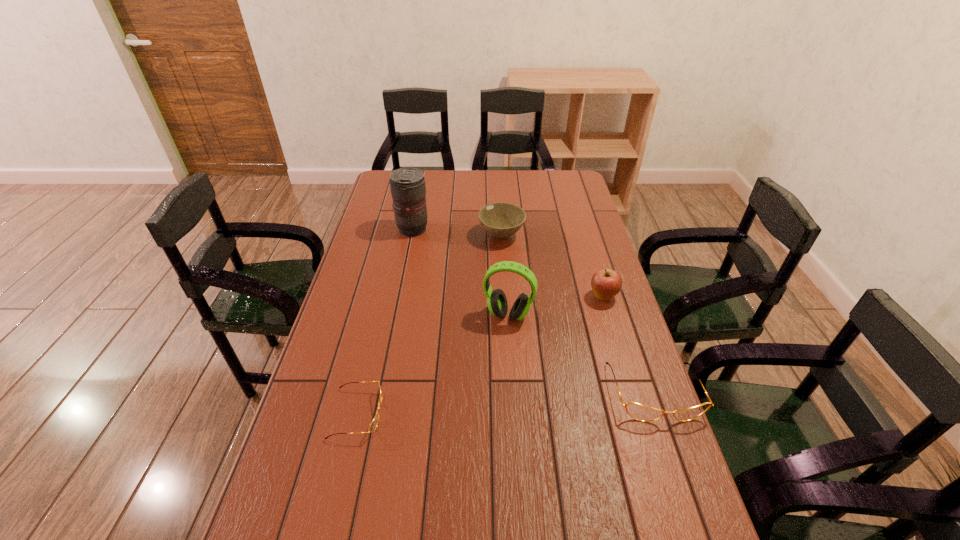
Where is `vacant position for inserting another spectacles evenly`? The width and height of the screenshot is (960, 540). vacant position for inserting another spectacles evenly is located at coordinates (509, 403).